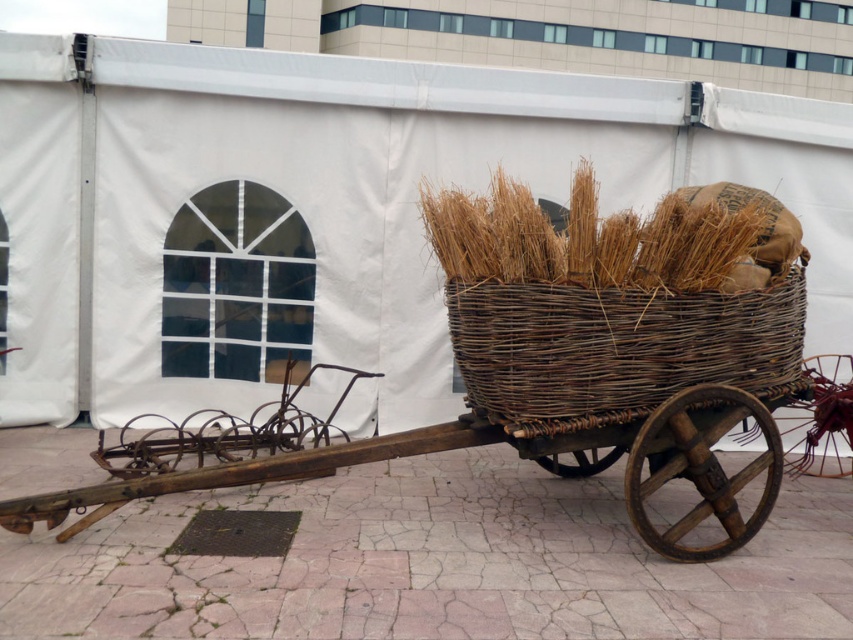
You are standing in front of the woven wood cart at center and want to place a tool in the woven brown basket at center. In which direction should you move the tool relative to the cart?

The woven brown basket at center is to the right of the woven wood cart at center, so you should move the tool to the right of the woven wood cart at center to place it in the basket.

You are a farmer standing at the edge of a field and see the woven brown basket at center and the woven wood cart at center. You want to place a 40 cm long pole between them. Will it fit? Please explain.

The distance between the woven brown basket at center and the woven wood cart at center is 39.04 centimeters. Since the pole is 40 cm long, it will not fit between them as the distance is shorter than the pole.

You are standing in front of the rustic wooden cart and want to place a new bundle of wheat. The cart has a specific location marked at point [616,342]. Where exactly on the cart should you place the new bundle?

The point [616,342] corresponds to the woven brown basket at center, so you should place the new bundle of wheat in the woven brown basket at center.